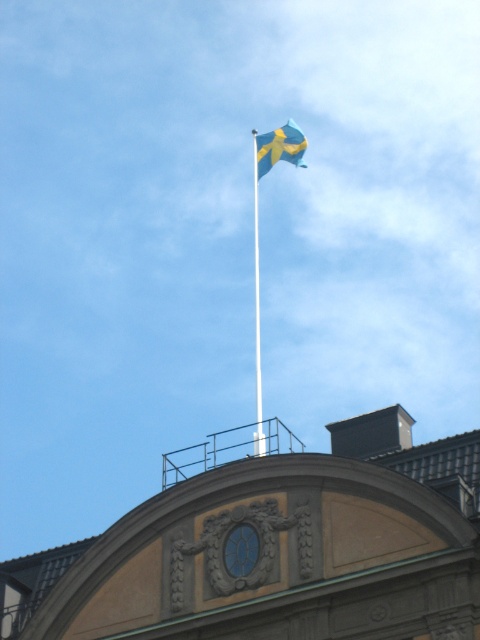
Question: Among these objects, which one is nearest to the camera?

Choices:
 (A) white smooth flag pole at upper center
 (B) blue fabric flag at upper center

Answer: (A)

Question: Is blue fabric flag at upper center closer to the viewer compared to white smooth flag pole at upper center?

Choices:
 (A) no
 (B) yes

Answer: (A)

Question: Is blue fabric flag at upper center to the left of white smooth flag pole at upper center from the viewer's perspective?

Choices:
 (A) no
 (B) yes

Answer: (A)

Question: In this image, where is blue fabric flag at upper center located relative to white smooth flag pole at upper center?

Choices:
 (A) left
 (B) right

Answer: (B)